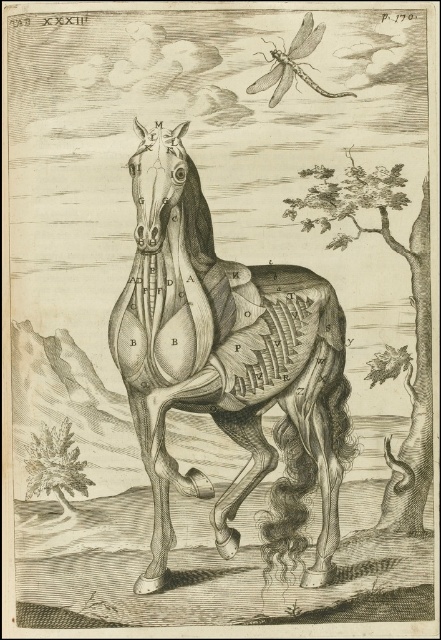
Can you confirm if gray textured horse at center is positioned to the left of translucent gray dragonfly at upper center?

Yes, gray textured horse at center is to the left of translucent gray dragonfly at upper center.

Does gray textured horse at center have a smaller size compared to translucent gray dragonfly at upper center?

No, gray textured horse at center is not smaller than translucent gray dragonfly at upper center.

The image size is (441, 640). I want to click on gray textured horse at center, so click(x=223, y=353).

You are a GUI agent. You are given a task and a screenshot of the screen. Output one action in this format:
    pyautogui.click(x=<x>, y=<y>)
    Task: Click on the gray textured horse at center
    The height and width of the screenshot is (640, 441).
    Given the screenshot: What is the action you would take?
    pyautogui.click(x=223, y=353)